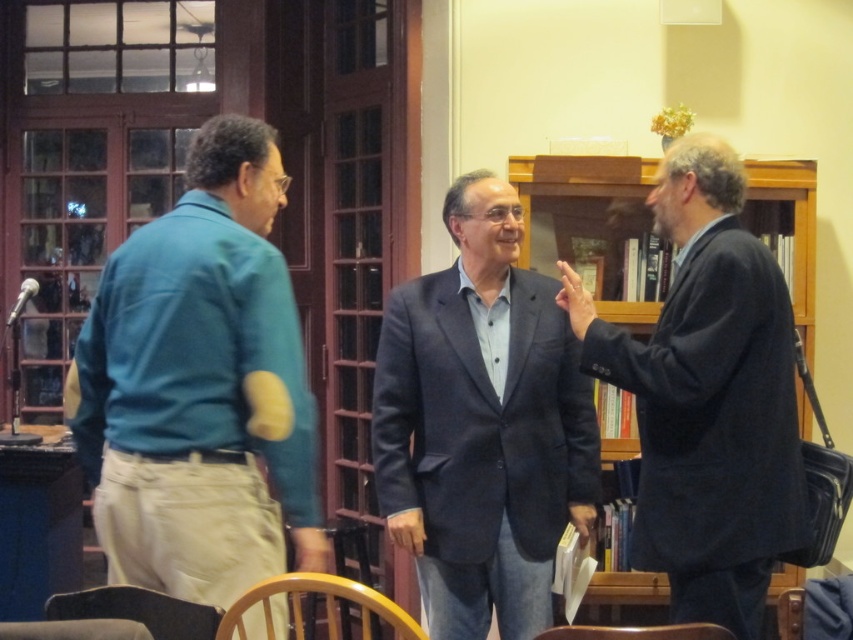
You are a person trying to sit down in the library. There is a wooden chair at lower left and a dark blue suit at right. Which one is closer to you?

The wooden chair at lower left is behind the dark blue suit at right, so the dark blue suit at right is closer to you.

You are trying to decide whether to place a new small potted plant between the dark blue suit at right and the brown wood chair at lower center. Based on their sizes, will there be enough space for the plant?

The dark blue suit at right is larger in size than the brown wood chair at lower center. Since the plant is small, there should be sufficient space between them to place it comfortably.

You are standing in the library and want to walk towards both the point at coordinates (664, 628) and the point at coordinates (570, 308). Which point will you reach first?

You will reach point (664, 628) first because it is closer to you than point (570, 308).